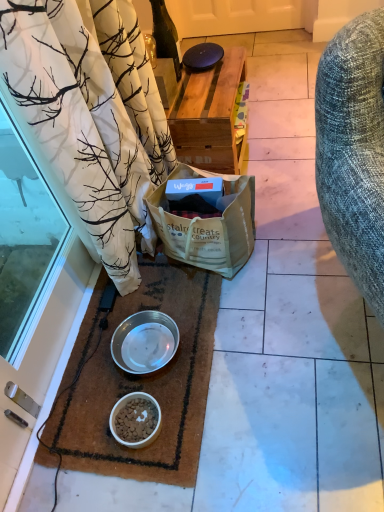
You are a GUI agent. You are given a task and a screenshot of the screen. Output one action in this format:
    pyautogui.click(x=<x>, y=<y>)
    Task: Click on the vacant space to the right of black glossy tile at center
    
    Given the screenshot: What is the action you would take?
    pyautogui.click(x=284, y=41)